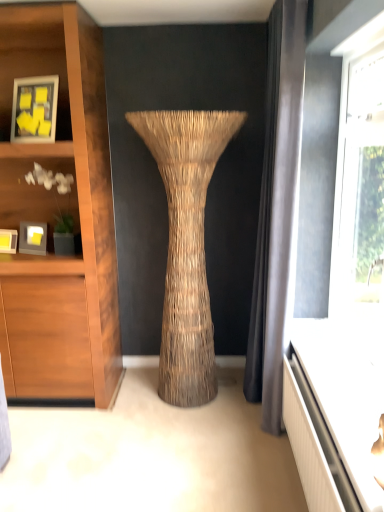
Find the location of a particular element. This screenshot has height=512, width=384. braided straw vase at center is located at coordinates (186, 244).

Describe the element at coordinates (186, 244) in the screenshot. The image size is (384, 512). I see `braided straw vase at center` at that location.

At what (x,y) coordinates should I click in order to perform the action: click on matte wood shelf at left. Please return your answer as a coordinate pair (x, y). Image resolution: width=384 pixels, height=512 pixels. Looking at the image, I should click on (36, 185).

You are a GUI agent. You are given a task and a screenshot of the screen. Output one action in this format:
    pyautogui.click(x=<x>, y=<y>)
    Task: Click on the matte black picture frame at left, the second picture frame from the bottom
    The image size is (384, 512).
    Given the screenshot: What is the action you would take?
    [33, 238]

Consider the image. Is white glossy vanity at lower right inside matte black picture frame at left, the first picture frame from the bottom?

No, white glossy vanity at lower right is located outside of matte black picture frame at left, the first picture frame from the bottom.

Considering the relative sizes of matte black picture frame at left, positioned as the 3th picture frame in top-to-bottom order, and white glossy vanity at lower right in the image provided, is matte black picture frame at left, positioned as the 3th picture frame in top-to-bottom order, shorter than white glossy vanity at lower right?

No, matte black picture frame at left, positioned as the 3th picture frame in top-to-bottom order, is not shorter than white glossy vanity at lower right.

Consider the image. Would you say matte black picture frame at left, positioned as the 3th picture frame in top-to-bottom order, is to the left or to the right of white glossy vanity at lower right in the picture?

Based on their positions, matte black picture frame at left, positioned as the 3th picture frame in top-to-bottom order, is located to the left of white glossy vanity at lower right.

You are a GUI agent. You are given a task and a screenshot of the screen. Output one action in this format:
    pyautogui.click(x=<x>, y=<y>)
    Task: Click on the 1st picture frame positioned above the matte black picture frame at left, positioned as the 3th picture frame in top-to-bottom order (from a real-world perspective)
    This screenshot has width=384, height=512.
    Given the screenshot: What is the action you would take?
    pyautogui.click(x=33, y=238)

Does matte black picture frame at left, the second picture frame when ordered from top to bottom, appear on the left side of matte black picture frame at left, positioned as the 3th picture frame in top-to-bottom order?

In fact, matte black picture frame at left, the second picture frame when ordered from top to bottom, is to the right of matte black picture frame at left, positioned as the 3th picture frame in top-to-bottom order.

From a real-world perspective, is matte black picture frame at left, the second picture frame when ordered from top to bottom, over matte black picture frame at left, the first picture frame from the bottom?

Yes, from a real-world perspective, matte black picture frame at left, the second picture frame when ordered from top to bottom, is over matte black picture frame at left, the first picture frame from the bottom

From a real-world perspective, does black fabric curtain at right sit lower than white glossy vanity at lower right?

Incorrect, from a real-world perspective, black fabric curtain at right is higher than white glossy vanity at lower right.

Is black fabric curtain at right wider or thinner than white glossy vanity at lower right?

black fabric curtain at right is thinner than white glossy vanity at lower right.

Considering the sizes of black fabric curtain at right and white glossy vanity at lower right in the image, is black fabric curtain at right taller or shorter than white glossy vanity at lower right?

Considering their sizes, black fabric curtain at right has more height than white glossy vanity at lower right.

Is black fabric curtain at right looking in the opposite direction of white glossy vanity at lower right?

black fabric curtain at right does not have its back to white glossy vanity at lower right.

Which object is further away from the camera taking this photo, matte black picture frame at left, the second picture frame when ordered from top to bottom, or matte yellow paper at upper left, which is the third picture frame in bottom-to-top order?

matte black picture frame at left, the second picture frame when ordered from top to bottom.

Considering the relative sizes of matte black picture frame at left, the second picture frame when ordered from top to bottom, and matte yellow paper at upper left, which is the first picture frame in top-to-bottom order, in the image provided, is matte black picture frame at left, the second picture frame when ordered from top to bottom, thinner than matte yellow paper at upper left, which is the first picture frame in top-to-bottom order,?

Incorrect, the width of matte black picture frame at left, the second picture frame when ordered from top to bottom, is not less than that of matte yellow paper at upper left, which is the first picture frame in top-to-bottom order.

From the image's perspective, would you say matte black picture frame at left, the second picture frame when ordered from top to bottom, is shown under matte yellow paper at upper left, which is the third picture frame in bottom-to-top order?

Yes, from the image's perspective, matte black picture frame at left, the second picture frame when ordered from top to bottom, is below matte yellow paper at upper left, which is the third picture frame in bottom-to-top order.

Is matte yellow paper at upper left, which is the first picture frame in top-to-bottom order, smaller than black fabric curtain at right?

Correct, matte yellow paper at upper left, which is the first picture frame in top-to-bottom order, occupies less space than black fabric curtain at right.

The width and height of the screenshot is (384, 512). Find the location of `curtain below the matte yellow paper at upper left, which is the third picture frame in bottom-to-top order (from a real-world perspective)`. curtain below the matte yellow paper at upper left, which is the third picture frame in bottom-to-top order (from a real-world perspective) is located at coordinates [277, 212].

Does point (27, 115) come closer to viewer compared to point (276, 88)?

Yes.

How different are the orientations of matte yellow paper at upper left, which is the first picture frame in top-to-bottom order, and black fabric curtain at right in degrees?

There is a 69.8-degree angle between the facing directions of matte yellow paper at upper left, which is the first picture frame in top-to-bottom order, and black fabric curtain at right.

Consider the image. Is matte yellow paper at upper left, which is the first picture frame in top-to-bottom order, positioned with its back to matte black picture frame at left, the second picture frame when ordered from top to bottom?

No, matte yellow paper at upper left, which is the first picture frame in top-to-bottom order, is not facing away from matte black picture frame at left, the second picture frame when ordered from top to bottom.

Is matte yellow paper at upper left, which is the third picture frame in bottom-to-top order, smaller than matte black picture frame at left, the second picture frame from the bottom?

Incorrect, matte yellow paper at upper left, which is the third picture frame in bottom-to-top order, is not smaller in size than matte black picture frame at left, the second picture frame from the bottom.

Are matte yellow paper at upper left, which is the first picture frame in top-to-bottom order, and matte black picture frame at left, the second picture frame when ordered from top to bottom, located far from each other?

matte yellow paper at upper left, which is the first picture frame in top-to-bottom order, is near matte black picture frame at left, the second picture frame when ordered from top to bottom, not far away.

From a real-world perspective, which object rests below the other?

braided straw vase at center, from a real-world perspective.

Measure the distance from matte yellow paper at upper left, which is the third picture frame in bottom-to-top order, to braided straw vase at center.

matte yellow paper at upper left, which is the third picture frame in bottom-to-top order, and braided straw vase at center are 31.84 inches apart.

Considering the relative positions of matte yellow paper at upper left, which is the first picture frame in top-to-bottom order, and braided straw vase at center in the image provided, is matte yellow paper at upper left, which is the first picture frame in top-to-bottom order, behind braided straw vase at center?

Yes.

Is matte yellow paper at upper left, which is the third picture frame in bottom-to-top order, looking in the opposite direction of braided straw vase at center?

No, matte yellow paper at upper left, which is the third picture frame in bottom-to-top order, is not facing away from braided straw vase at center.

What are the coordinates of `the 1st picture frame located above the white glossy vanity at lower right (from a real-world perspective)` in the screenshot? It's located at (8, 241).

Identify the location of picture frame that appears below the matte black picture frame at left, the second picture frame from the bottom (from a real-world perspective). The height and width of the screenshot is (512, 384). (8, 241).

Looking at the image, which one is located further to white glossy vanity at lower right, matte wood shelf at left or matte black picture frame at left, the second picture frame from the bottom?

matte black picture frame at left, the second picture frame from the bottom, lies further to white glossy vanity at lower right than the other object.

Based on their spatial positions, is matte black picture frame at left, the second picture frame when ordered from top to bottom, or white glossy vanity at lower right further from braided straw vase at center?

matte black picture frame at left, the second picture frame when ordered from top to bottom.

From the image, which object appears to be farther from white glossy vanity at lower right, braided straw vase at center or matte black picture frame at left, the second picture frame when ordered from top to bottom?

matte black picture frame at left, the second picture frame when ordered from top to bottom, lies further to white glossy vanity at lower right than the other object.

Considering their positions, is matte yellow paper at upper left, which is the third picture frame in bottom-to-top order, positioned further to matte black picture frame at left, positioned as the 3th picture frame in top-to-bottom order, than black fabric curtain at right?

black fabric curtain at right is positioned further to the anchor matte black picture frame at left, positioned as the 3th picture frame in top-to-bottom order.

From the image, which object appears to be farther from matte wood shelf at left, matte black picture frame at left, the second picture frame when ordered from top to bottom, or braided straw vase at center?

The object further to matte wood shelf at left is braided straw vase at center.

When comparing their distances from matte black picture frame at left, the first picture frame from the bottom, does braided straw vase at center or matte yellow paper at upper left, which is the first picture frame in top-to-bottom order, seem further?

braided straw vase at center.

When comparing their distances from matte black picture frame at left, the second picture frame from the bottom, does white glossy vanity at lower right or matte black picture frame at left, the first picture frame from the bottom, seem further?

white glossy vanity at lower right.

Which object lies nearer to the anchor point matte yellow paper at upper left, which is the first picture frame in top-to-bottom order, white glossy vanity at lower right or braided straw vase at center?

braided straw vase at center is positioned closer to the anchor matte yellow paper at upper left, which is the first picture frame in top-to-bottom order.

I want to click on shelf between matte yellow paper at upper left, which is the third picture frame in bottom-to-top order, and white glossy vanity at lower right from left to right, so click(36, 185).

At what (x,y) coordinates should I click in order to perform the action: click on vase between matte black picture frame at left, the second picture frame from the bottom, and black fabric curtain at right from left to right. Please return your answer as a coordinate pair (x, y). Looking at the image, I should click on click(x=186, y=244).

Identify the location of curtain between matte black picture frame at left, the second picture frame from the bottom, and white glossy vanity at lower right from left to right. (277, 212).

Image resolution: width=384 pixels, height=512 pixels. I want to click on curtain situated between matte wood shelf at left and white glossy vanity at lower right from left to right, so click(x=277, y=212).